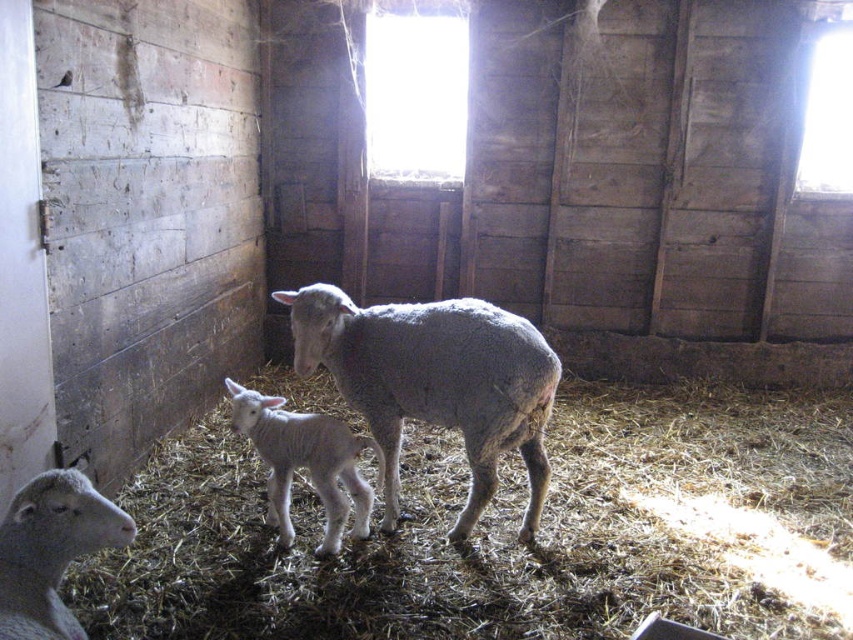
You are a farmer checking the barn. You need to separate the gray woolen sheep at lower left from the white woolen lamb at center. Which one requires a wider pen to accommodate its size?

The white woolen lamb at center requires a wider pen because its width is greater than the gray woolen sheep at lower left.

You are a farmer checking the barn and notice the fuzzy straw at lower left. Where exactly is the fuzzy straw located in the barn?

The fuzzy straw at lower left is located at point (506, 531).